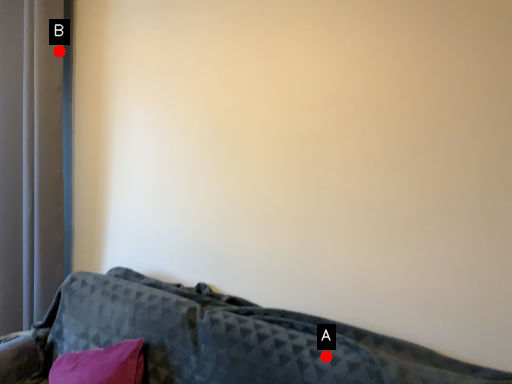
Question: Two points are circled on the image, labeled by A and B beside each circle. Which point appears closest to the camera in this image?

Choices:
 (A) A is closer
 (B) B is closer

Answer: (A)